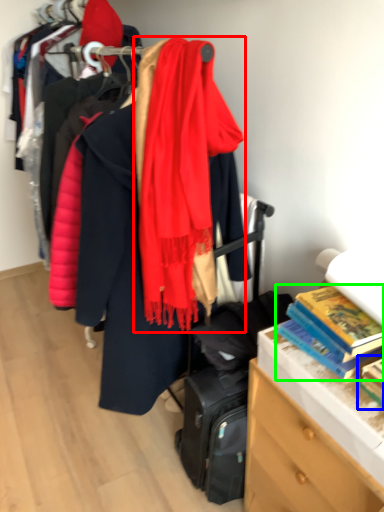
Question: Based on their relative distances, which object is farther from scarf (highlighted by a red box)? Choose from book (highlighted by a blue box) and book (highlighted by a green box).

Choices:
 (A) book
 (B) book

Answer: (A)